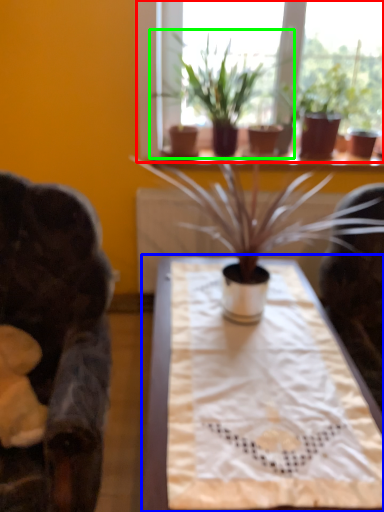
Question: Estimate the real-world distances between objects in this image. Which object is farther from window (highlighted by a red box), table (highlighted by a blue box) or houseplant (highlighted by a green box)?

Choices:
 (A) table
 (B) houseplant

Answer: (A)